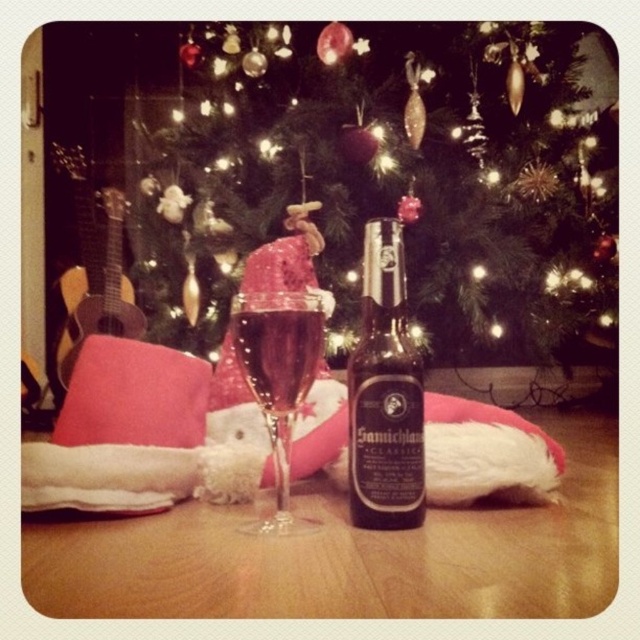
Does green matte christmas tree at center have a larger size compared to translucent glass at center?

Indeed, green matte christmas tree at center has a larger size compared to translucent glass at center.

Is point (173, 340) positioned after point (234, 346)?

Yes, point (173, 340) is behind point (234, 346).

You are a GUI agent. You are given a task and a screenshot of the screen. Output one action in this format:
    pyautogui.click(x=<x>, y=<y>)
    Task: Click on the green matte christmas tree at center
    Image resolution: width=640 pixels, height=640 pixels.
    Given the screenshot: What is the action you would take?
    pyautogui.click(x=408, y=173)

Is black matte bottle at center shorter than transparent glass at center?

In fact, black matte bottle at center may be taller than transparent glass at center.

Does black matte bottle at center appear on the left side of transparent glass at center?

In fact, black matte bottle at center is to the right of transparent glass at center.

Who is more distant from viewer, (394, 371) or (268, 397)?

The point (394, 371) is more distant.

Identify the location of black matte bottle at center. (385, 394).

Does point (250, 378) lie behind point (292, 413)?

No, it is not.

Does transparent glass at center have a larger size compared to translucent glass at center?

Indeed, transparent glass at center has a larger size compared to translucent glass at center.

Is point (262, 388) positioned after point (310, 323)?

Yes, point (262, 388) is behind point (310, 323).

The height and width of the screenshot is (640, 640). What are the coordinates of `transparent glass at center` in the screenshot? It's located at (278, 380).